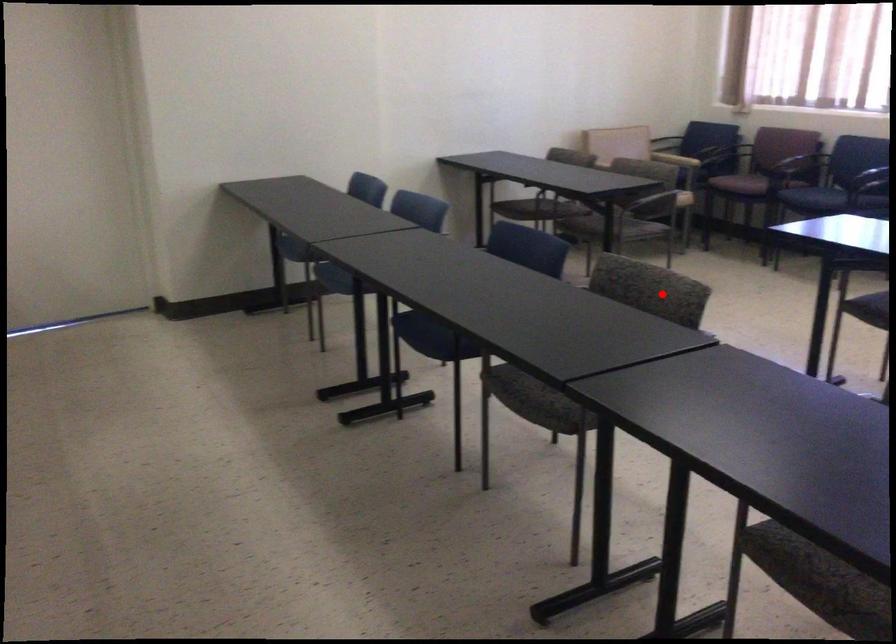
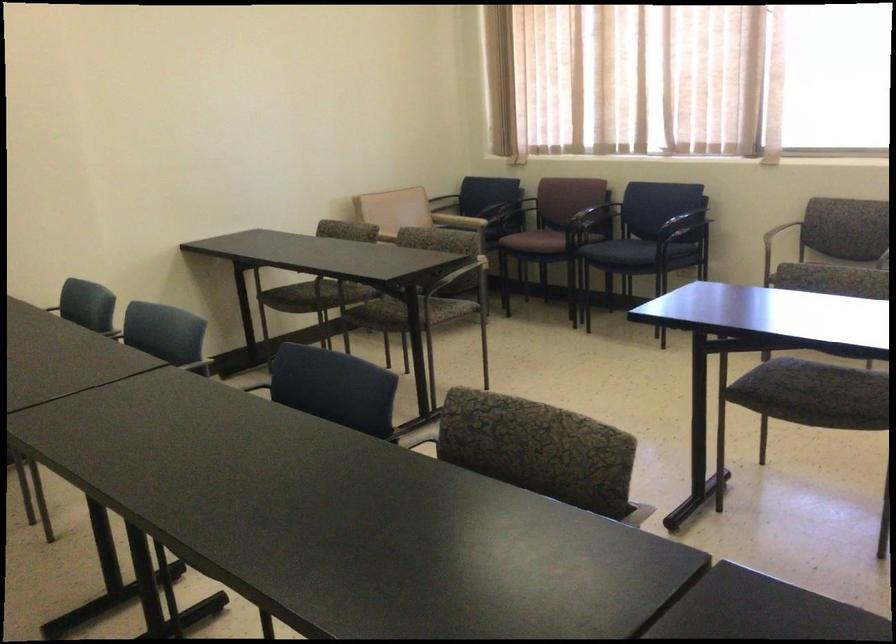
Question: A red point is marked in image1. In image2, is the corresponding 3D point closer to the camera or farther? Reply with the corresponding letter.

Choices:
 (A) The corresponding 3D point is closer.
 (B) The corresponding 3D point is farther.

Answer: (A)